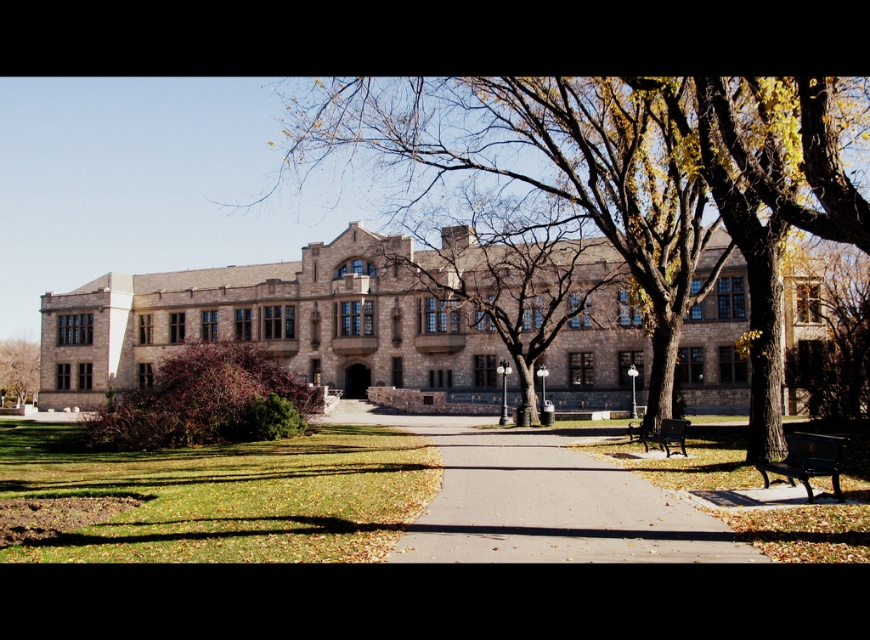
Question: In this image, where is concrete sidewalk at center located relative to metallic black bench at lower right?

Choices:
 (A) above
 (B) below

Answer: (B)

Question: Which is nearer to the metallic black bench at lower right?

Choices:
 (A) brown textured tree at center
 (B) concrete sidewalk at center

Answer: (B)

Question: Which point appears farthest from the camera in this image?

Choices:
 (A) click(5, 342)
 (B) click(805, 452)

Answer: (A)

Question: Which object is the closest to the brown textured tree at left?

Choices:
 (A) brown stone tree at center
 (B) brown textured bush at left
 (C) concrete sidewalk at center
 (D) wooden park bench at lower right

Answer: (B)

Question: Where is brown stone tree at center located in relation to brown textured tree at left in the image?

Choices:
 (A) right
 (B) left

Answer: (A)

Question: Does brown textured bush at left have a larger size compared to metallic black bench at lower right?

Choices:
 (A) yes
 (B) no

Answer: (A)